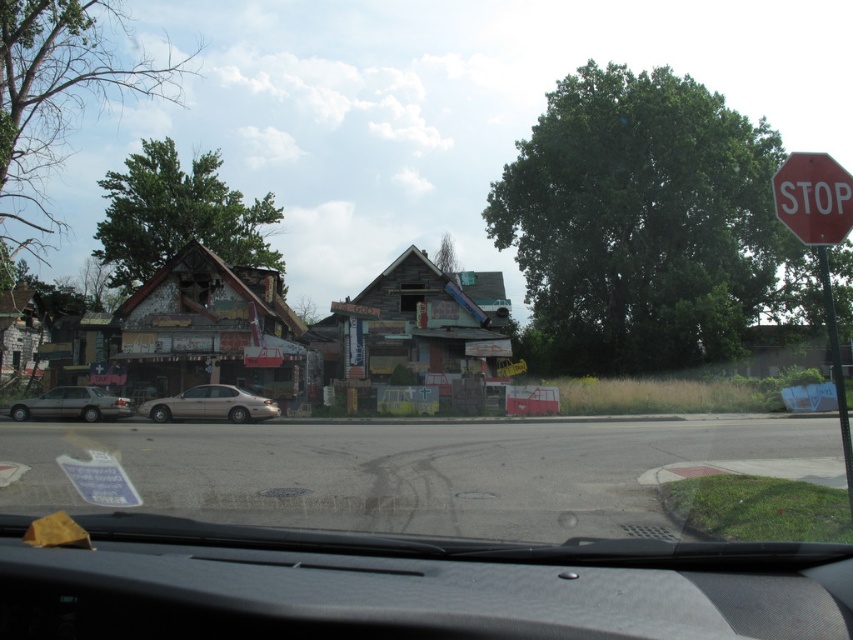
Question: Which object is farther from the camera taking this photo?

Choices:
 (A) silver metallic sedan at left
 (B) gold metallic sedan at center
 (C) transparent glass windshield at lower center

Answer: (B)

Question: Which object appears farthest from the camera in this image?

Choices:
 (A) gold metallic sedan at center
 (B) black textured dashboard at center
 (C) metallic pole at right
 (D) silver metallic sedan at left

Answer: (A)

Question: Which object is the farthest from the black textured dashboard at center?

Choices:
 (A) transparent glass windshield at lower center
 (B) silver metallic sedan at left
 (C) gold metallic sedan at center

Answer: (B)

Question: Is black textured dashboard at center above gold metallic sedan at center?

Choices:
 (A) no
 (B) yes

Answer: (B)

Question: Does red plastic stop sign at upper right appear on the left side of gold metallic sedan at center?

Choices:
 (A) no
 (B) yes

Answer: (A)

Question: Does red plastic stop sign at upper right appear under silver metallic sedan at left?

Choices:
 (A) no
 (B) yes

Answer: (A)